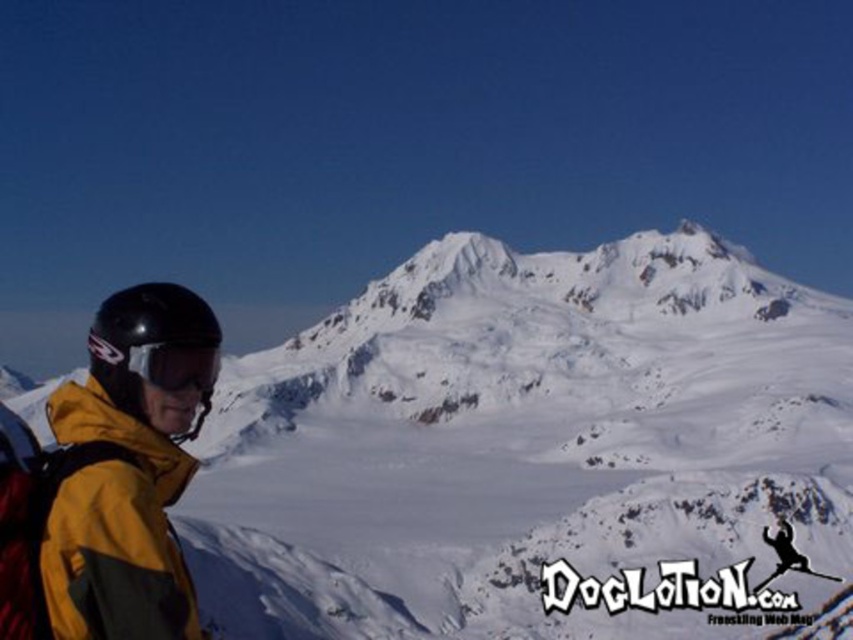
Does white powdery snow at center have a larger size compared to shiny black ski at lower right?

→ Yes, white powdery snow at center is bigger than shiny black ski at lower right.

Does point (815, 490) lie in front of point (793, 566)?

No.

Where is `white powdery snow at center`? This screenshot has height=640, width=853. white powdery snow at center is located at coordinates (527, 445).

Who is lower down, yellow matte jacket at lower left or matte black goggles at left?

yellow matte jacket at lower left is below.

Does point (149, 378) lie behind point (196, 358)?

No, (149, 378) is closer to viewer.

Image resolution: width=853 pixels, height=640 pixels. Identify the location of yellow matte jacket at lower left. (129, 468).

Can you confirm if white powdery snow at center is taller than yellow matte jacket at lower left?

Yes.

Who is higher up, white powdery snow at center or yellow matte jacket at lower left?

yellow matte jacket at lower left is above.

Image resolution: width=853 pixels, height=640 pixels. I want to click on white powdery snow at center, so click(x=527, y=445).

Locate an element on the screen. This screenshot has height=640, width=853. white powdery snow at center is located at coordinates (527, 445).